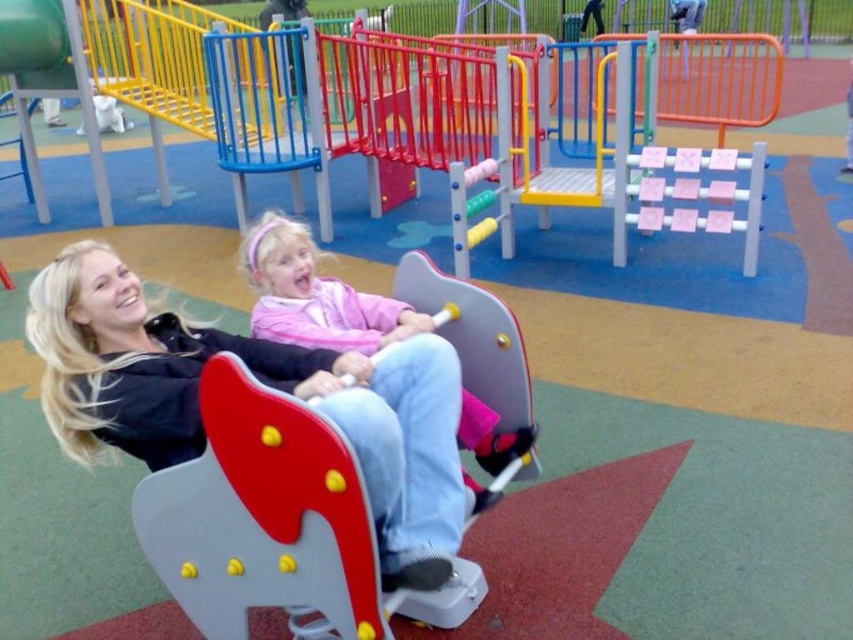
Question: Does matte black jacket at center appear on the right side of pink matte shirt at center?

Choices:
 (A) yes
 (B) no

Answer: (B)

Question: Is matte black jacket at center in front of pink matte shirt at center?

Choices:
 (A) no
 (B) yes

Answer: (B)

Question: Which point is farther to the camera?

Choices:
 (A) (306, 276)
 (B) (349, 401)

Answer: (A)

Question: Which point is farther to the camera?

Choices:
 (A) (520, 428)
 (B) (117, 336)

Answer: (A)

Question: From the image, what is the correct spatial relationship of matte black jacket at center in relation to pink matte shirt at center?

Choices:
 (A) right
 (B) left

Answer: (B)

Question: Which point is closer to the camera?

Choices:
 (A) pink matte shirt at center
 (B) matte black jacket at center

Answer: (B)